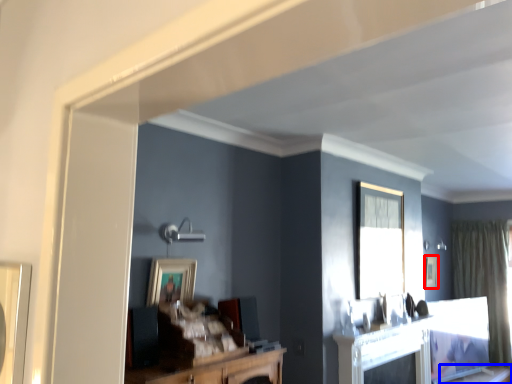
Question: Which point is further to the camera, picture frame (highlighted by a red box) or table (highlighted by a blue box)?

Choices:
 (A) picture frame
 (B) table

Answer: (A)